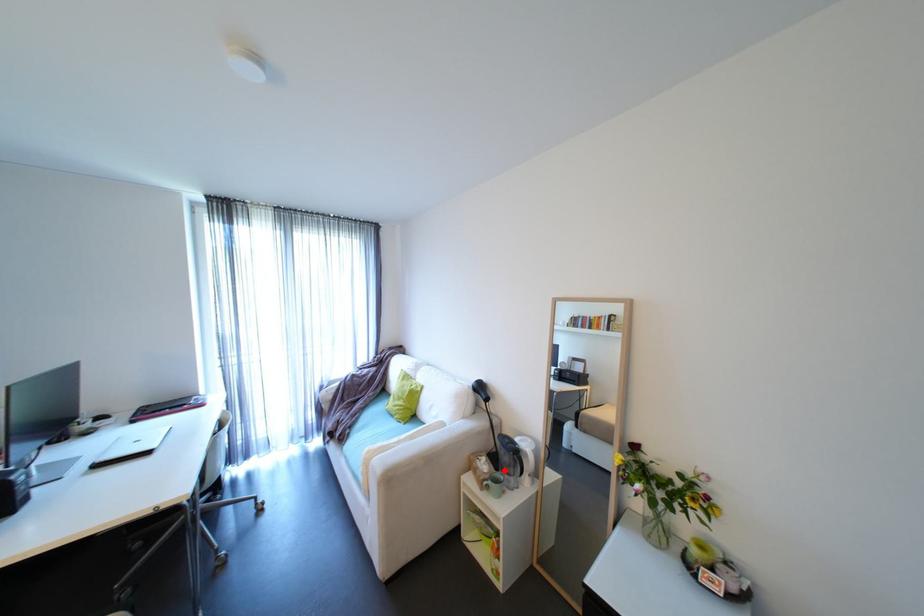
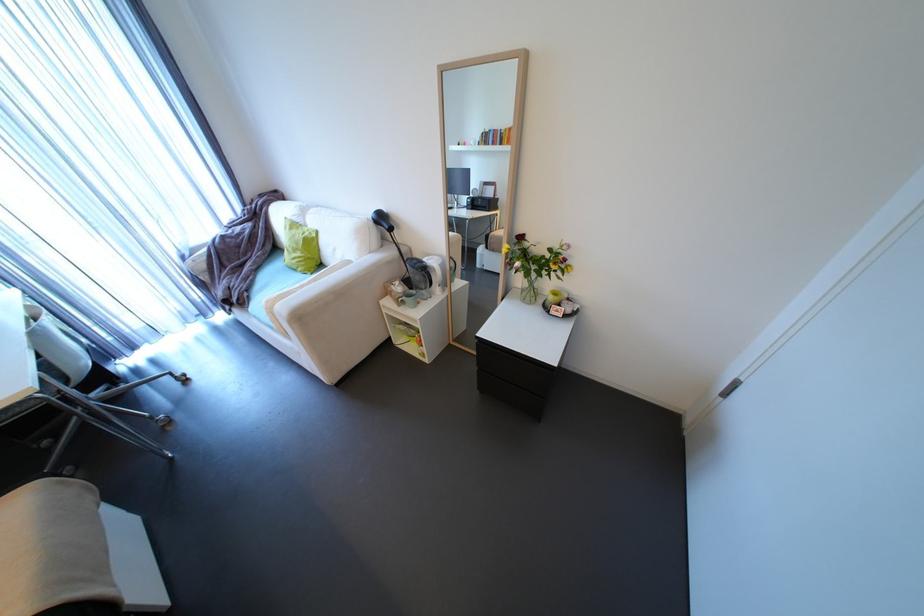
Question: A red point is marked in image1. In image2, is the corresponding 3D point closer to the camera or farther? Reply with the corresponding letter.

Choices:
 (A) The corresponding 3D point is closer.
 (B) The corresponding 3D point is farther.

Answer: (A)